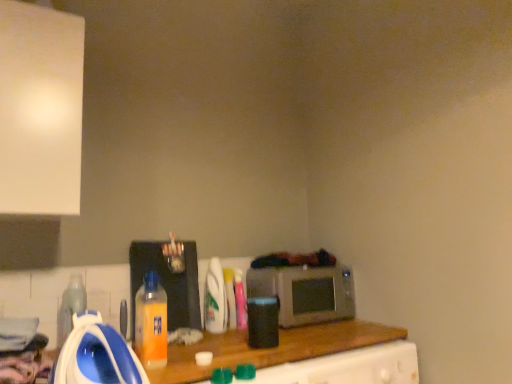
Where is `free point above translucent plastic bottle at center, the first appliance viewed from the back (from a real-world perspective)`? This screenshot has width=512, height=384. free point above translucent plastic bottle at center, the first appliance viewed from the back (from a real-world perspective) is located at coordinates (165, 233).